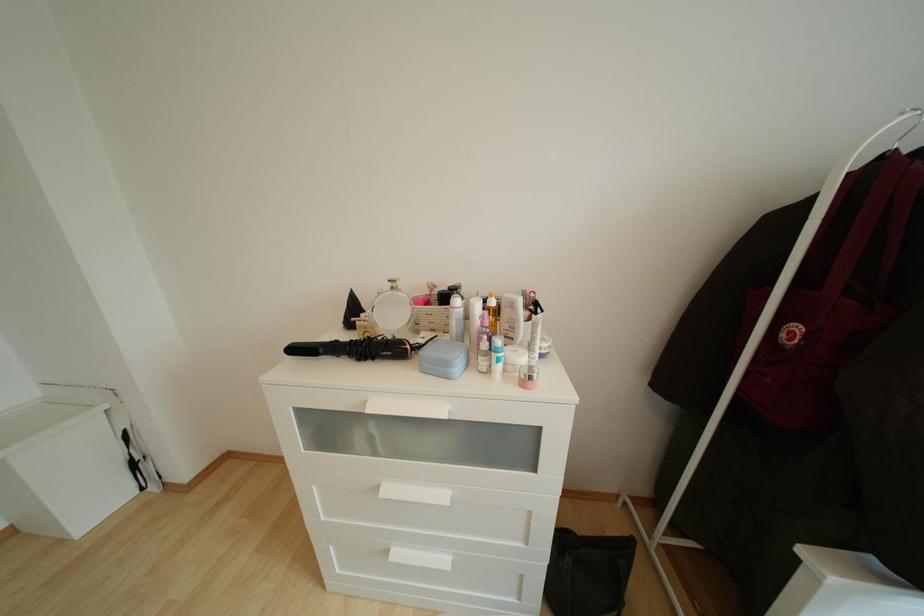
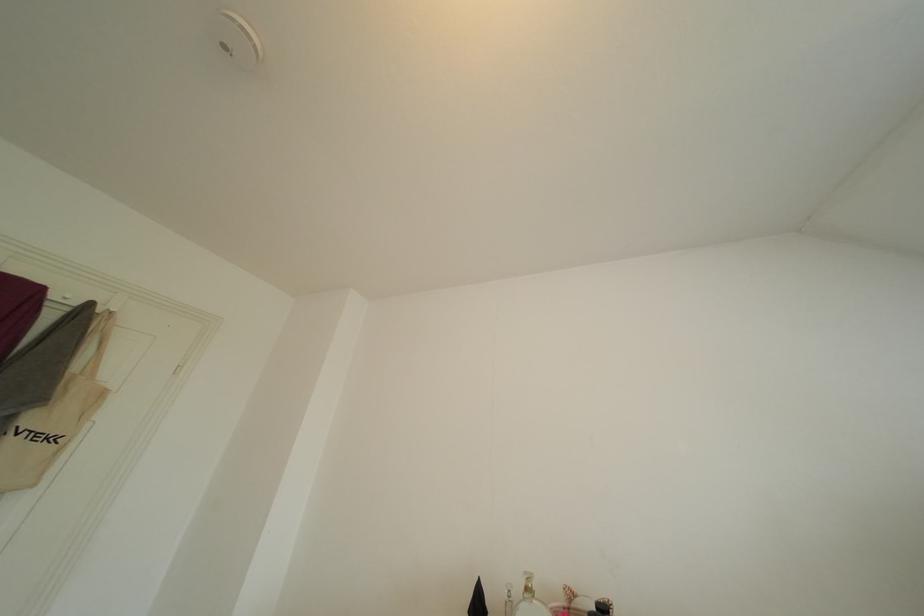
First-person continuous shooting, in which direction is the camera rotating?

The rotation direction of the camera is left-up.